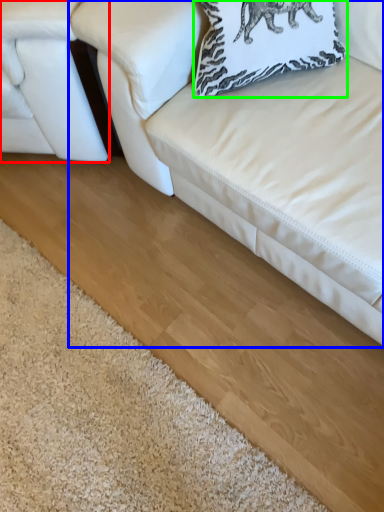
Question: Which object is positioned farthest from studio couch (highlighted by a red box)? Select from studio couch (highlighted by a blue box) and pillow (highlighted by a green box).

Choices:
 (A) studio couch
 (B) pillow

Answer: (B)